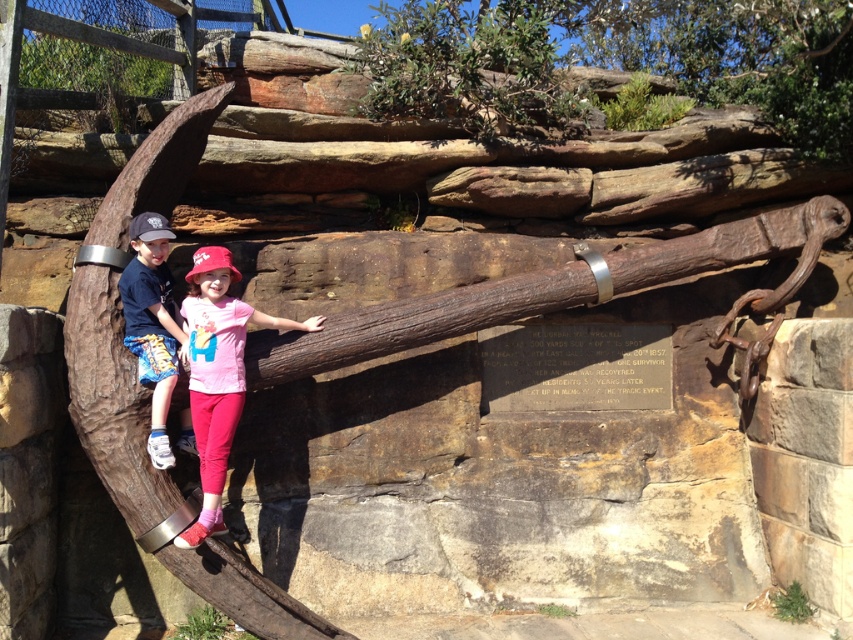
Question: Which point is closer to the camera taking this photo?

Choices:
 (A) (206, 410)
 (B) (163, 285)

Answer: (A)

Question: Is matte pink shirt at center closer to camera compared to blue denim shorts at left?

Choices:
 (A) yes
 (B) no

Answer: (A)

Question: Is matte pink shirt at center to the left of blue denim shorts at left from the viewer's perspective?

Choices:
 (A) no
 (B) yes

Answer: (A)

Question: Is matte pink shirt at center positioned in front of blue denim shorts at left?

Choices:
 (A) no
 (B) yes

Answer: (B)

Question: Which object appears farthest from the camera in this image?

Choices:
 (A) matte pink shirt at center
 (B) blue denim shorts at left

Answer: (B)